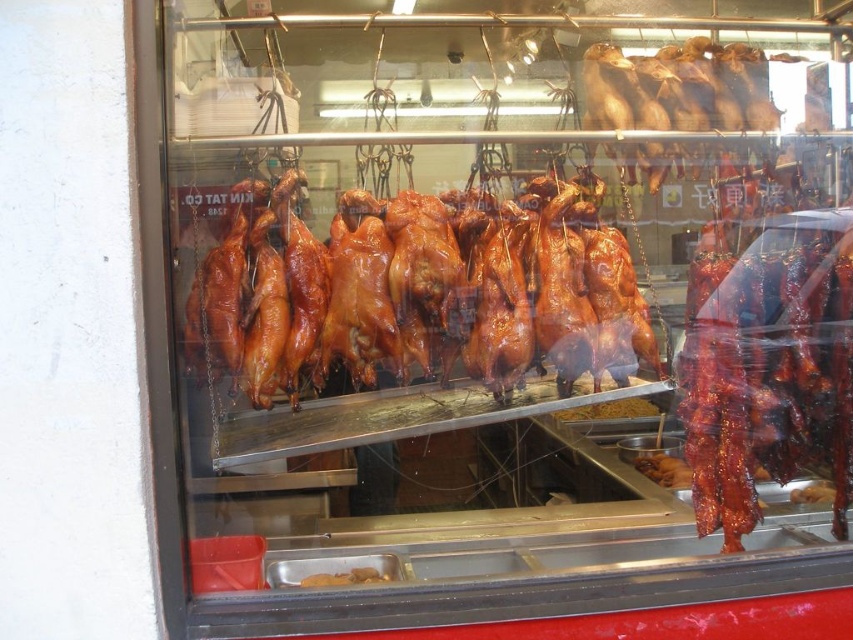
You are a customer standing in front of the display case. You want to grab the shiny brown meat at center. Can you reach it without opening the case?

The shiny brown meat at center is 6.35 feet away from you. Since the display case is glass enclosed and the meat is suspended at that distance, it is likely out of your reach without opening the case.

You are a customer at the food stall and want to point out the shiny brown meat at center to the vendor. Since the display case has a red base at the bottom, can you describe its exact position using the coordinates provided?

The shiny brown meat at center is located at point 0.586 on the x axis and 0.904 on the y axis, which is near the bottom of the display case since the y coordinate is close to 1.0.